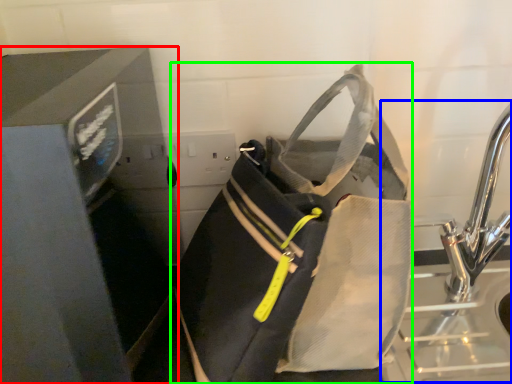
Question: Estimate the real-world distances between objects in this image. Which object is closer to appliance (highlighted by a red box), sink (highlighted by a blue box) or luggage and bags (highlighted by a green box)?

Choices:
 (A) sink
 (B) luggage and bags

Answer: (B)